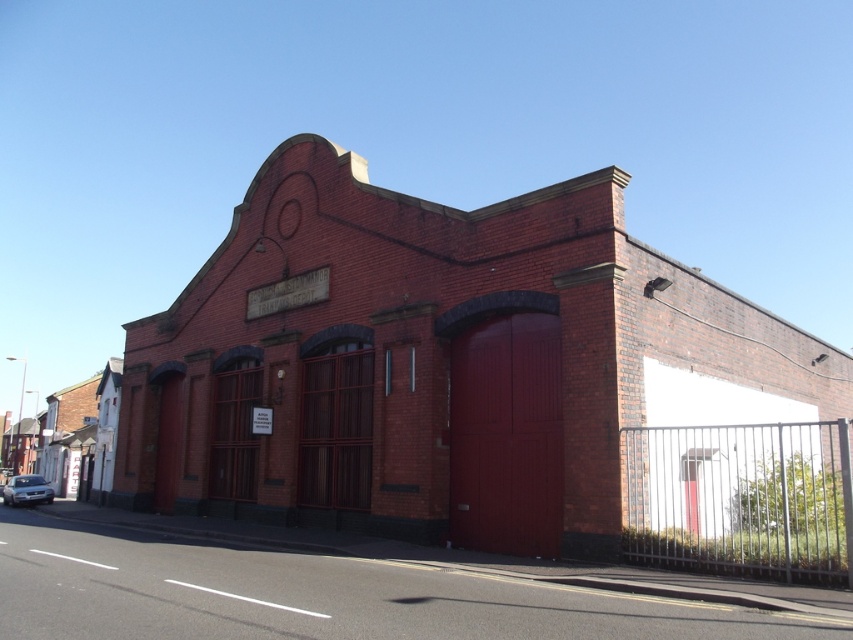
You are a city planner assessing the space in front of the brick fire station at center and the satin silver car at lower left. Which object takes up more area in the image?

The brick fire station at center is bigger than the satin silver car at lower left, so it occupies more area in the image.

You are a delivery driver approaching a red brick building with a fire station sign. You see the brick fire station at center and the satin silver car at lower left. Which object is positioned higher from the ground?

The brick fire station at center is above the satin silver car at lower left, so it is positioned higher from the ground.